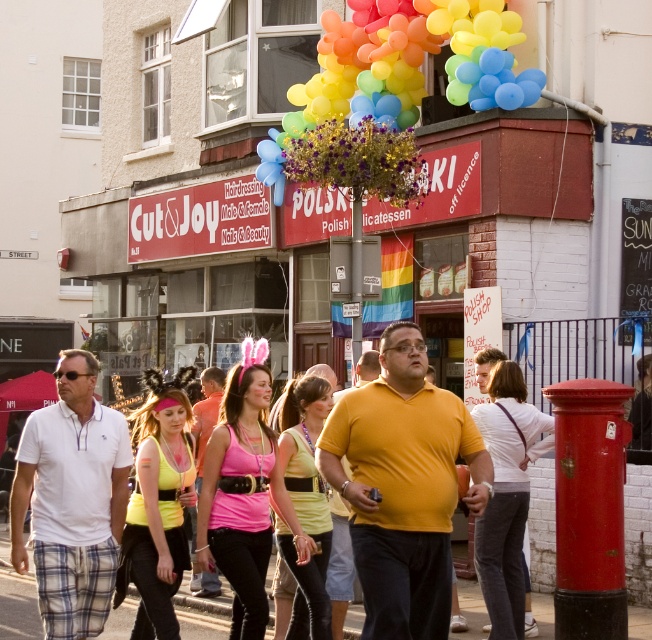
You are a customer trying to choose between two shirts displayed in the shop window. The shirts are the white cotton polo shirt at center and the pink fabric top at center. Which shirt takes up more horizontal space in the display?

The white cotton polo shirt at center might be wider than pink fabric top at center, so it likely takes up more horizontal space in the display.

You are a customer standing in front of the shop and see both the neon yellow fabric at center and the matte yellow tank top at center. Which one is closer to you?

The neon yellow fabric at center is closer to you since it is in front of the matte yellow tank top at center.